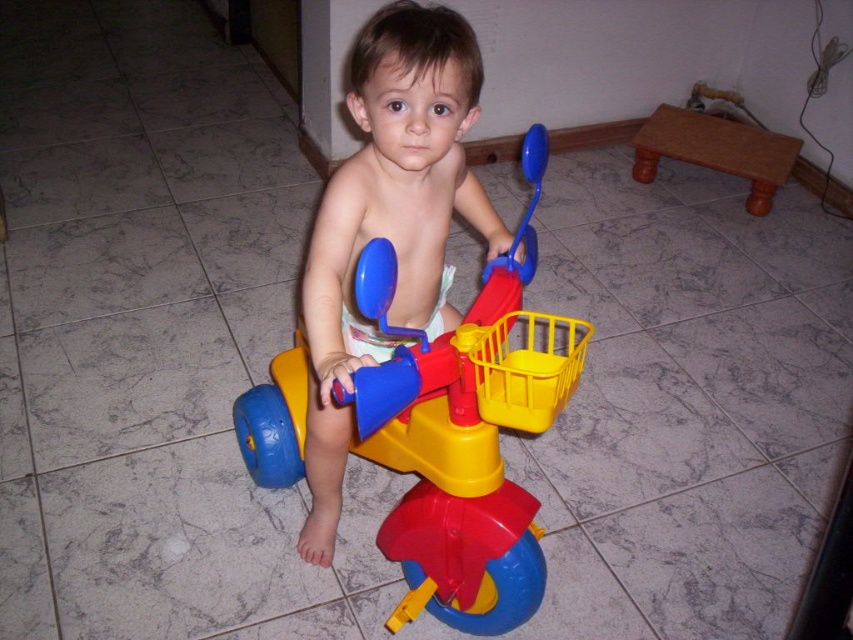
Is matte plastic tricycle at center smaller than matte plastic child at center?

Actually, matte plastic tricycle at center might be larger than matte plastic child at center.

Is matte plastic tricycle at center below matte plastic child at center?

Correct, matte plastic tricycle at center is located below matte plastic child at center.

Locate an element on the screen. This screenshot has height=640, width=853. matte plastic tricycle at center is located at coordinates (450, 467).